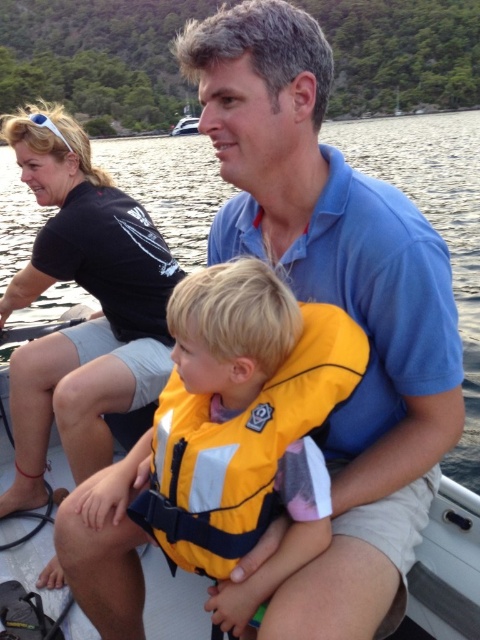
Question: Which object is closer to the camera taking this photo?

Choices:
 (A) black fabric shirt at upper left
 (B) yellow fabric life jacket at center

Answer: (B)

Question: Observing the image, what is the correct spatial positioning of black fabric shirt at upper left in reference to yellow fabric life jacket at center?

Choices:
 (A) below
 (B) above

Answer: (B)

Question: Which of the following is the farthest from the observer?

Choices:
 (A) black fabric shirt at upper left
 (B) yellow fabric life jacket at center

Answer: (A)

Question: Does black fabric shirt at upper left lie in front of yellow fabric life jacket at center?

Choices:
 (A) yes
 (B) no

Answer: (B)

Question: Which of the following is the farthest from the observer?

Choices:
 (A) yellow fabric life jacket at center
 (B) black fabric shirt at upper left

Answer: (B)

Question: Does black fabric shirt at upper left appear on the left side of yellow fabric life jacket at center?

Choices:
 (A) no
 (B) yes

Answer: (B)